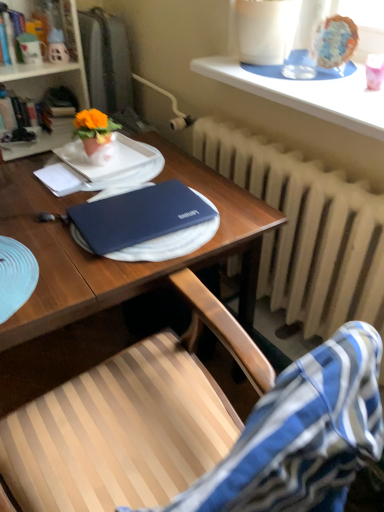
Find the location of a particular element. This screenshot has height=512, width=384. free space in front of matte orange flowerpot at upper left is located at coordinates (102, 169).